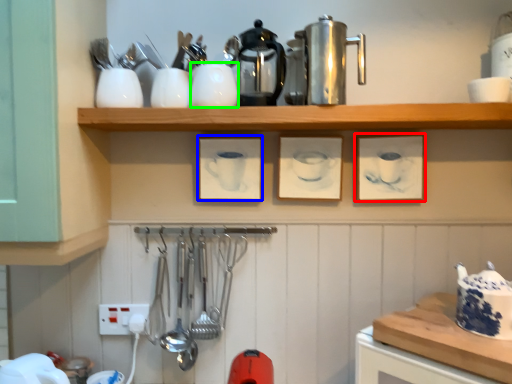
Question: Which is farther away from picture frame (highlighted by a red box)? picture frame (highlighted by a blue box) or tableware (highlighted by a green box)?

Choices:
 (A) picture frame
 (B) tableware

Answer: (B)